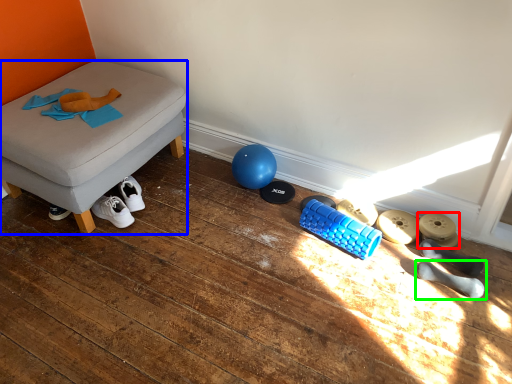
Question: Considering the real-world distances, which object is closest to footwear (highlighted by a red box)? furniture (highlighted by a blue box) or footwear (highlighted by a green box).

Choices:
 (A) furniture
 (B) footwear

Answer: (B)